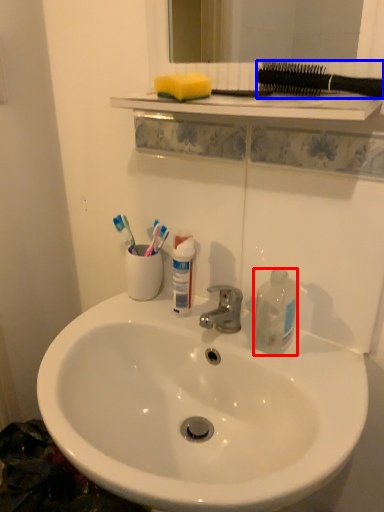
Question: Which object is closer to the camera taking this photo, bottle (highlighted by a red box) or toothbrushes (highlighted by a blue box)?

Choices:
 (A) bottle
 (B) toothbrushes

Answer: (B)